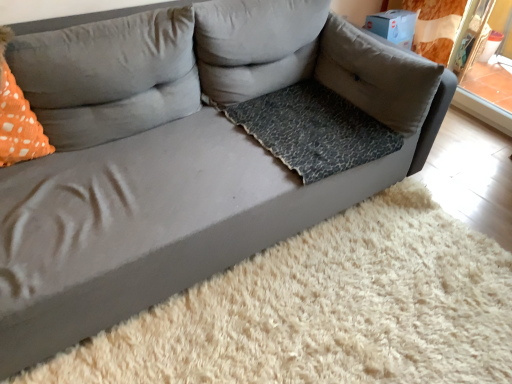
Find the location of a particular element. The image size is (512, 384). gray fabric pillow at center, which is the second pillow in right-to-left order is located at coordinates (255, 45).

What do you see at coordinates (376, 75) in the screenshot? The image size is (512, 384). I see `gray fabric pillow at upper right, the third pillow viewed from the left` at bounding box center [376, 75].

What is the approximate width of gray fabric pillow at upper right, the first pillow in the right-to-left sequence?

gray fabric pillow at upper right, the first pillow in the right-to-left sequence, is 9.95 inches in width.

The height and width of the screenshot is (384, 512). What do you see at coordinates (312, 129) in the screenshot?
I see `leopard print fabric dog bed at center` at bounding box center [312, 129].

You are a GUI agent. You are given a task and a screenshot of the screen. Output one action in this format:
    pyautogui.click(x=<x>, y=<y>)
    Task: Click on the gray fabric pillow at center, which is the 2th pillow in left-to-right order
    
    Given the screenshot: What is the action you would take?
    pyautogui.click(x=255, y=45)

From the image's perspective, who appears lower, orange dotted fabric at left or orange dotted pillow at left, acting as the 3th pillow starting from the right?

orange dotted fabric at left, from the image's perspective.

Is orange dotted fabric at left oriented away from orange dotted pillow at left, acting as the 3th pillow starting from the right?

That's not correct — orange dotted fabric at left is not looking away from orange dotted pillow at left, acting as the 3th pillow starting from the right.

Visually, is orange dotted fabric at left positioned to the left or to the right of orange dotted pillow at left, the first pillow from the left?

Clearly, orange dotted fabric at left is on the left of orange dotted pillow at left, the first pillow from the left, in the image.

Is point (17, 93) behind point (263, 114)?

No, it is in front of (263, 114).

Locate an element on the screen. Image resolution: width=512 pixels, height=384 pixels. dog bed below the orange dotted fabric at left (from a real-world perspective) is located at coordinates (312, 129).

Measure the distance from orange dotted fabric at left to leopard print fabric dog bed at center.

They are 95.44 centimeters apart.

Is orange dotted fabric at left touching leopard print fabric dog bed at center?

orange dotted fabric at left and leopard print fabric dog bed at center are not in contact.

Is point (244, 12) positioned behind point (441, 69)?

Yes.

From a real-world perspective, who is located lower, gray fabric pillow at center, which is the 2th pillow in left-to-right order, or gray fabric pillow at upper right, the third pillow viewed from the left?

gray fabric pillow at upper right, the third pillow viewed from the left.

Relative to gray fabric pillow at upper right, the first pillow in the right-to-left sequence, is gray fabric pillow at center, which is the 2th pillow in left-to-right order, in front or behind?

Visually, gray fabric pillow at center, which is the 2th pillow in left-to-right order, is located in front of gray fabric pillow at upper right, the first pillow in the right-to-left sequence.

From the image's perspective, which one is positioned lower, leopard print fabric dog bed at center or gray fabric pillow at upper right, the first pillow in the right-to-left sequence?

From the image's view, leopard print fabric dog bed at center is below.

Between leopard print fabric dog bed at center and gray fabric pillow at upper right, the first pillow in the right-to-left sequence, which one has less height?

Standing shorter between the two is leopard print fabric dog bed at center.

Is leopard print fabric dog bed at center facing away from gray fabric pillow at upper right, the first pillow in the right-to-left sequence?

That's not correct — leopard print fabric dog bed at center is not looking away from gray fabric pillow at upper right, the first pillow in the right-to-left sequence.

Looking at this image, is leopard print fabric dog bed at center positioned far away from gray fabric pillow at upper right, the third pillow viewed from the left?

No, leopard print fabric dog bed at center is not far from gray fabric pillow at upper right, the third pillow viewed from the left.

Is gray fabric pillow at center, which is the second pillow in right-to-left order, oriented towards leopard print fabric dog bed at center?

Yes, gray fabric pillow at center, which is the second pillow in right-to-left order, is aimed at leopard print fabric dog bed at center.

Can you confirm if gray fabric pillow at center, which is the 2th pillow in left-to-right order, is smaller than leopard print fabric dog bed at center?

Actually, gray fabric pillow at center, which is the 2th pillow in left-to-right order, might be larger than leopard print fabric dog bed at center.

Is gray fabric pillow at center, which is the 2th pillow in left-to-right order, in front of or behind leopard print fabric dog bed at center in the image?

In the image, gray fabric pillow at center, which is the 2th pillow in left-to-right order, appears behind leopard print fabric dog bed at center.

You are a GUI agent. You are given a task and a screenshot of the screen. Output one action in this format:
    pyautogui.click(x=<x>, y=<y>)
    Task: Click on the pillow that is the 3rd one above the leopard print fabric dog bed at center (from a real-world perspective)
    This screenshot has height=384, width=512.
    Given the screenshot: What is the action you would take?
    pyautogui.click(x=255, y=45)

Between leopard print fabric dog bed at center and gray fabric pillow at center, which is the second pillow in right-to-left order, which one is positioned in front?

leopard print fabric dog bed at center is more forward.

From the image's perspective, which one is positioned higher, leopard print fabric dog bed at center or gray fabric pillow at center, which is the 2th pillow in left-to-right order?

gray fabric pillow at center, which is the 2th pillow in left-to-right order, is shown above in the image.

Considering the sizes of leopard print fabric dog bed at center and gray fabric pillow at center, which is the second pillow in right-to-left order, in the image, is leopard print fabric dog bed at center taller or shorter than gray fabric pillow at center, which is the second pillow in right-to-left order,?

In the image, leopard print fabric dog bed at center appears to be shorter than gray fabric pillow at center, which is the second pillow in right-to-left order.

From a real-world perspective, relative to gray fabric pillow at center, which is the second pillow in right-to-left order, is leopard print fabric dog bed at center vertically above or below?

In terms of real-world spatial position, leopard print fabric dog bed at center is below gray fabric pillow at center, which is the second pillow in right-to-left order.

Does orange dotted fabric at left turn towards gray fabric pillow at upper right, the first pillow in the right-to-left sequence?

No.

From the image's perspective, does orange dotted fabric at left appear higher than gray fabric pillow at upper right, the first pillow in the right-to-left sequence?

Incorrect, from the image's perspective, orange dotted fabric at left is lower than gray fabric pillow at upper right, the first pillow in the right-to-left sequence.

Based on the photo, could you measure the distance between orange dotted fabric at left and gray fabric pillow at upper right, the third pillow viewed from the left?

orange dotted fabric at left is 4.51 feet away from gray fabric pillow at upper right, the third pillow viewed from the left.

From a real-world perspective, does orange dotted fabric at left stand above gray fabric pillow at upper right, the third pillow viewed from the left?

Yes, from a real-world perspective, orange dotted fabric at left is on top of gray fabric pillow at upper right, the third pillow viewed from the left.

What are the coordinates of `the 1st pillow directly above the orange dotted fabric at left (from a real-world perspective)` in the screenshot? It's located at (109, 76).

Identify the location of throw pillow above the leopard print fabric dog bed at center (from the image's perspective). (17, 117).

When comparing their distances from orange dotted fabric at left, does gray fabric pillow at center, which is the second pillow in right-to-left order, or orange dotted pillow at left, the first pillow from the left, seem further?

gray fabric pillow at center, which is the second pillow in right-to-left order, lies further to orange dotted fabric at left than the other object.

Looking at the image, which one is located closer to gray fabric pillow at center, which is the 2th pillow in left-to-right order, orange dotted pillow at left, the first pillow from the left, or gray fabric pillow at upper right, the first pillow in the right-to-left sequence?

Among the two, orange dotted pillow at left, the first pillow from the left, is located nearer to gray fabric pillow at center, which is the 2th pillow in left-to-right order.

Estimate the real-world distances between objects in this image. Which object is closer to gray fabric pillow at center, which is the second pillow in right-to-left order, leopard print fabric dog bed at center or orange dotted pillow at left, acting as the 3th pillow starting from the right?

Among the two, leopard print fabric dog bed at center is located nearer to gray fabric pillow at center, which is the second pillow in right-to-left order.

Estimate the real-world distances between objects in this image. Which object is further from gray fabric pillow at center, which is the second pillow in right-to-left order, orange dotted pillow at left, acting as the 3th pillow starting from the right, or orange dotted fabric at left?

The object further to gray fabric pillow at center, which is the second pillow in right-to-left order, is orange dotted fabric at left.

Estimate the real-world distances between objects in this image. Which object is closer to orange dotted fabric at left, orange dotted pillow at left, the first pillow from the left, or leopard print fabric dog bed at center?

Among the two, orange dotted pillow at left, the first pillow from the left, is located nearer to orange dotted fabric at left.

When comparing their distances from orange dotted pillow at left, the first pillow from the left, does leopard print fabric dog bed at center or gray fabric pillow at upper right, the first pillow in the right-to-left sequence, seem further?

The object further to orange dotted pillow at left, the first pillow from the left, is gray fabric pillow at upper right, the first pillow in the right-to-left sequence.

Considering their positions, is gray fabric pillow at upper right, the first pillow in the right-to-left sequence, positioned closer to gray fabric pillow at center, which is the second pillow in right-to-left order, than leopard print fabric dog bed at center?

leopard print fabric dog bed at center.

Considering their positions, is gray fabric pillow at upper right, the first pillow in the right-to-left sequence, positioned further to orange dotted pillow at left, the first pillow from the left, than leopard print fabric dog bed at center?

Based on the image, gray fabric pillow at upper right, the first pillow in the right-to-left sequence, appears to be further to orange dotted pillow at left, the first pillow from the left.

Image resolution: width=512 pixels, height=384 pixels. In order to click on dog bed between orange dotted pillow at left, the first pillow from the left, and gray fabric pillow at upper right, the third pillow viewed from the left in this screenshot , I will do `click(312, 129)`.

Locate an element on the screen. This screenshot has height=384, width=512. dog bed between orange dotted fabric at left and gray fabric pillow at upper right, the third pillow viewed from the left, in the horizontal direction is located at coordinates (312, 129).

Identify the location of pillow between orange dotted fabric at left and gray fabric pillow at center, which is the second pillow in right-to-left order. (109, 76).

Identify the location of pillow located between orange dotted pillow at left, the first pillow from the left, and gray fabric pillow at upper right, the first pillow in the right-to-left sequence, in the left-right direction. (255, 45).